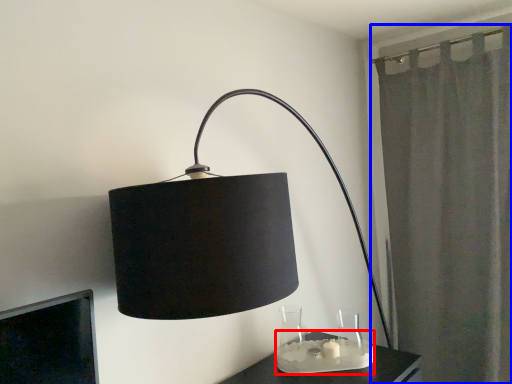
Question: Which of the following is the closest to the observer, candle holder (highlighted by a red box) or curtain (highlighted by a blue box)?

Choices:
 (A) candle holder
 (B) curtain

Answer: (A)